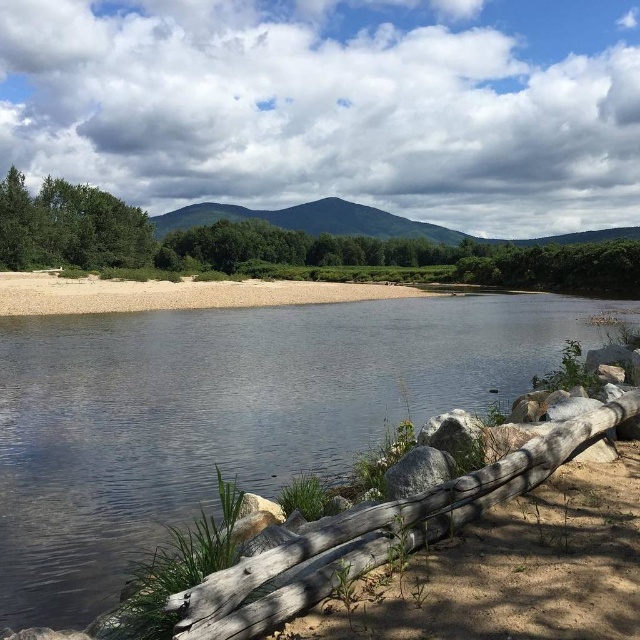
Question: Among these objects, which one is nearest to the camera?

Choices:
 (A) green leafy tree at left
 (B) green matte tree at left
 (C) clear water at center

Answer: (C)

Question: Does clear water at center appear on the left side of green matte tree at left?

Choices:
 (A) no
 (B) yes

Answer: (A)

Question: Which of the following is the farthest from the observer?

Choices:
 (A) (104, 282)
 (B) (129, 424)

Answer: (A)

Question: Which point is farther to the camera?

Choices:
 (A) (131, 292)
 (B) (224, 266)
 (C) (99, 204)
 (D) (65, 337)

Answer: (B)

Question: Where is clear water at center located in relation to brown sand at lower center in the image?

Choices:
 (A) above
 (B) below

Answer: (B)

Question: Considering the relative positions of green leafy tree at left and brown sand at lower center in the image provided, where is green leafy tree at left located with respect to brown sand at lower center?

Choices:
 (A) right
 (B) left

Answer: (A)